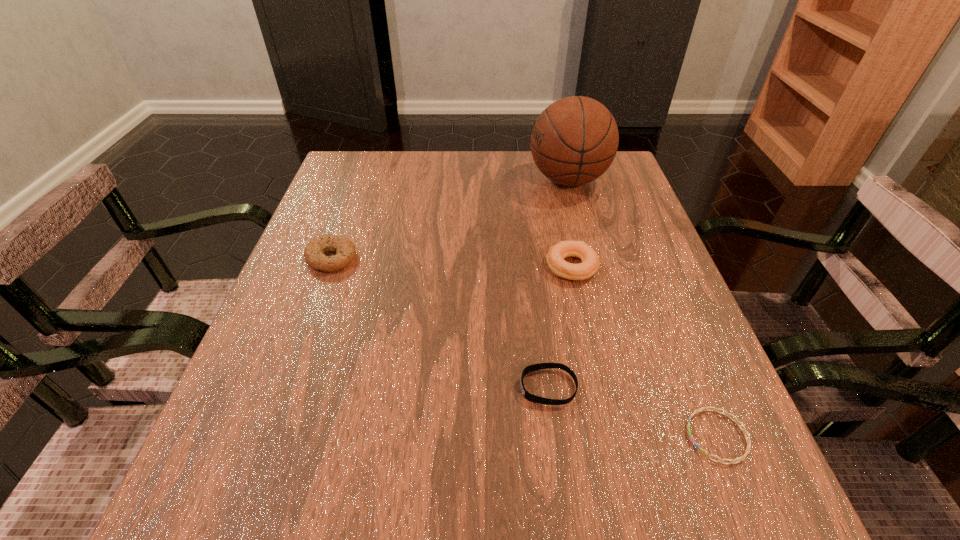
The height and width of the screenshot is (540, 960). In order to click on vacant space located on the side with brand label of the basketball in this screenshot , I will do `click(402, 179)`.

Locate an element on the screen. free location located on the left of the right bagel is located at coordinates (513, 267).

At what (x,y) coordinates should I click in order to perform the action: click on free space located 0.190m on the front of the left bagel. Please return your answer as a coordinate pair (x, y). Looking at the image, I should click on point(298,351).

Identify the location of free space located 0.360m on the display of the second shortest object. The width and height of the screenshot is (960, 540). (296, 387).

You are a GUI agent. You are given a task and a screenshot of the screen. Output one action in this format:
    pyautogui.click(x=<x>, y=<y>)
    Task: Click on the vacant area situated on the display of the second shortest object
    The image size is (960, 540).
    Given the screenshot: What is the action you would take?
    click(x=444, y=387)

You are a GUI agent. You are given a task and a screenshot of the screen. Output one action in this format:
    pyautogui.click(x=<x>, y=<y>)
    Task: Click on the vacant space located on the display of the second shortest object
    
    Given the screenshot: What is the action you would take?
    pyautogui.click(x=450, y=387)

Locate an element on the screen. This screenshot has height=540, width=960. vacant position located on the surface of the bracelet showing star-shaped elements is located at coordinates (613, 436).

The width and height of the screenshot is (960, 540). I want to click on free space located on the surface of the bracelet showing star-shaped elements, so click(x=525, y=436).

You are a GUI agent. You are given a task and a screenshot of the screen. Output one action in this format:
    pyautogui.click(x=<x>, y=<y>)
    Task: Click on the vacant space located on the surface of the bracelet showing star-shaped elements
    The width and height of the screenshot is (960, 540).
    Given the screenshot: What is the action you would take?
    pyautogui.click(x=497, y=436)

This screenshot has width=960, height=540. Identify the location of object situated at the far edge. (575, 139).